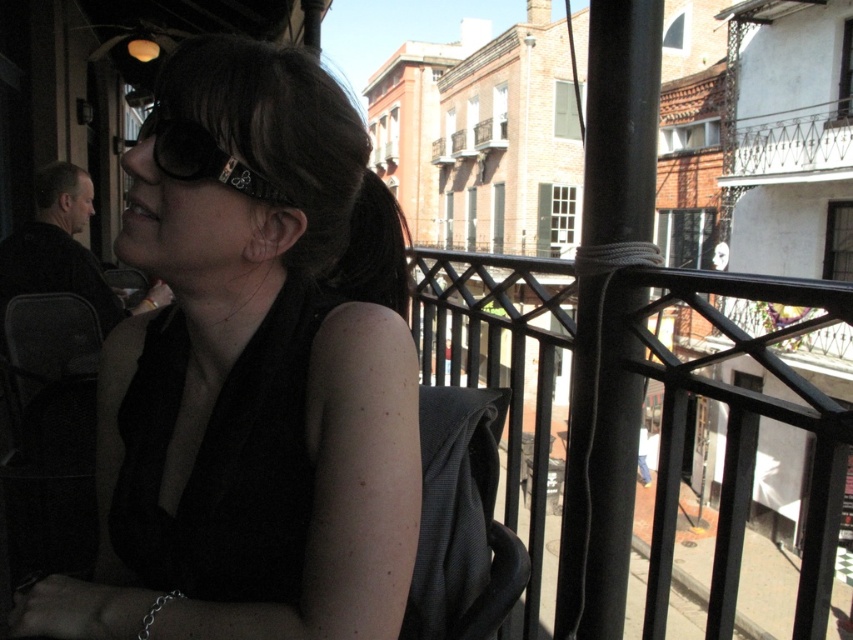
Question: Which point appears closest to the camera in this image?

Choices:
 (A) (753, 448)
 (B) (194, 234)

Answer: (B)

Question: Among these objects, which one is nearest to the camera?

Choices:
 (A) matte black goggles at upper left
 (B) matte black sunglasses at upper left
 (C) black metal railing at center

Answer: (B)

Question: Does matte black sunglasses at upper left have a lesser width compared to matte black goggles at upper left?

Choices:
 (A) yes
 (B) no

Answer: (B)

Question: Can you confirm if black metal railing at center is wider than matte black goggles at upper left?

Choices:
 (A) yes
 (B) no

Answer: (A)

Question: Can you confirm if matte black sunglasses at upper left is wider than black metal railing at center?

Choices:
 (A) no
 (B) yes

Answer: (A)

Question: Which point is closer to the camera?

Choices:
 (A) (144, 244)
 (B) (561, 340)

Answer: (A)